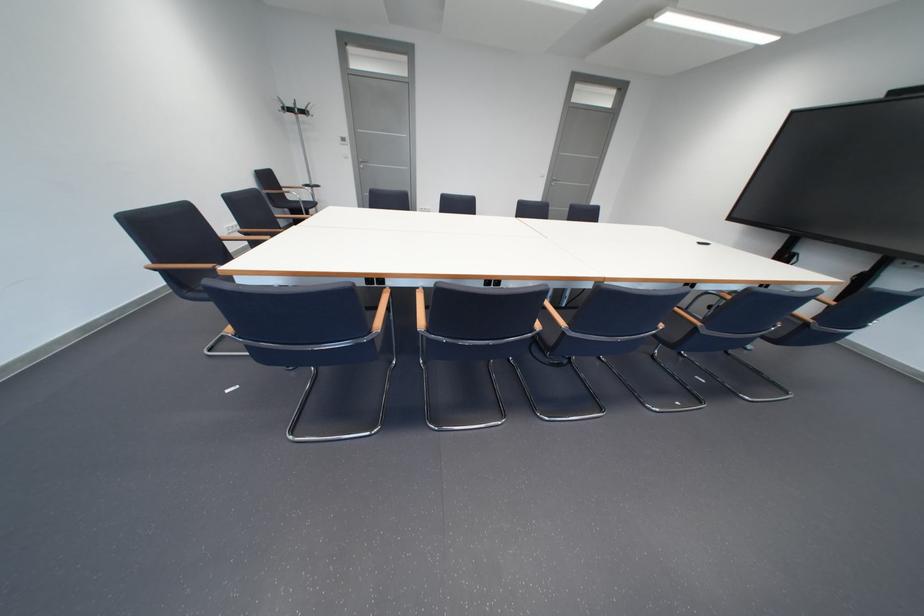
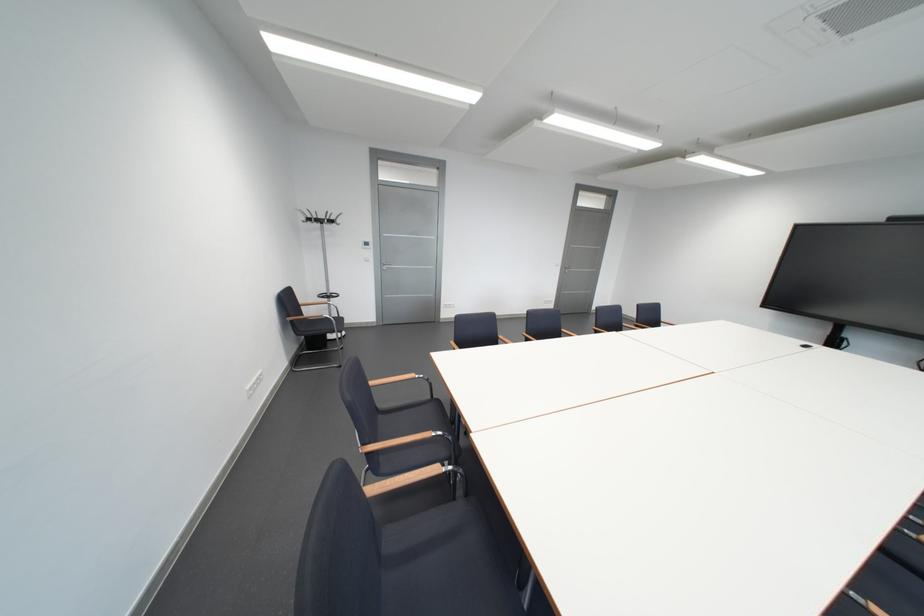
The images are taken continuously from a first-person perspective. In which direction are you moving?

The cameraman walked toward left, forward.